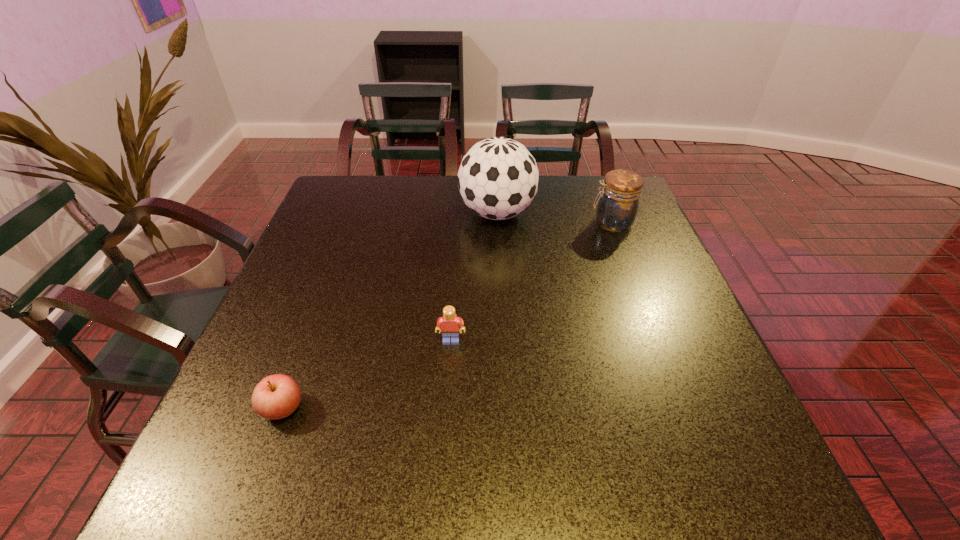
In order to click on the tallest object in this screenshot , I will do `click(498, 177)`.

Locate an element on the screen. The image size is (960, 540). jar is located at coordinates (618, 204).

In order to click on the second tallest object in this screenshot , I will do `click(618, 204)`.

In order to click on the second shortest object in this screenshot , I will do point(449,324).

At what (x,y) coordinates should I click in order to perform the action: click on Lego. Please return your answer as a coordinate pair (x, y). This screenshot has width=960, height=540. Looking at the image, I should click on (449, 324).

Where is `the nearest object`? The height and width of the screenshot is (540, 960). the nearest object is located at coordinates (277, 396).

Identify the location of apple. (277, 396).

Locate an element on the screen. The image size is (960, 540). blank area located on the front of the tallest object is located at coordinates (504, 339).

Identify the location of free space located on the lid of the jar. This screenshot has height=540, width=960. (515, 223).

The height and width of the screenshot is (540, 960). I want to click on vacant space located 0.320m on the lid of the jar, so click(480, 223).